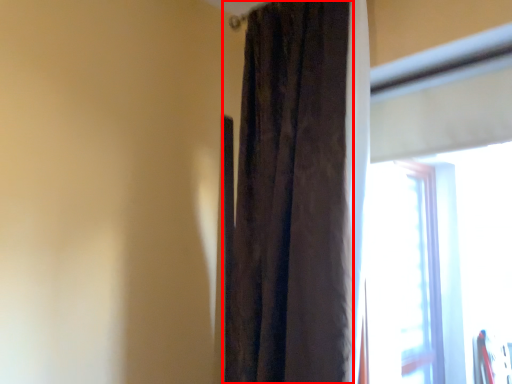
Question: Observing the image, what is the correct spatial positioning of curtain (annotated by the red box) in reference to window?

Choices:
 (A) left
 (B) right

Answer: (A)